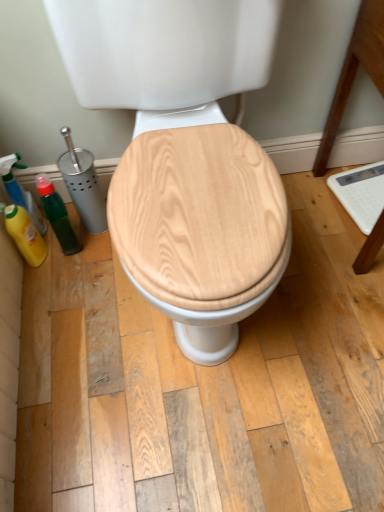
The width and height of the screenshot is (384, 512). Identify the location of vacant space in front of matte green spray bottle at left, marked as the 2th cleaning product in a bottom-to-top arrangement. (61, 268).